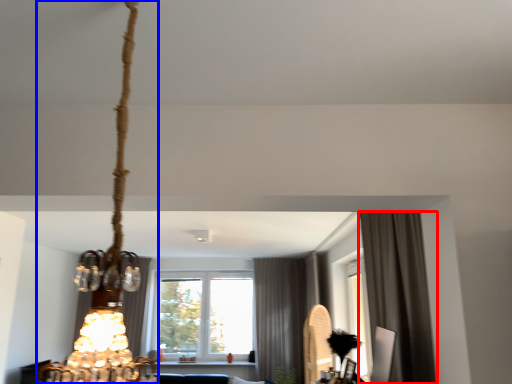
Question: Which object appears closest to the camera in this image, curtain (highlighted by a red box) or lamp (highlighted by a blue box)?

Choices:
 (A) curtain
 (B) lamp

Answer: (B)